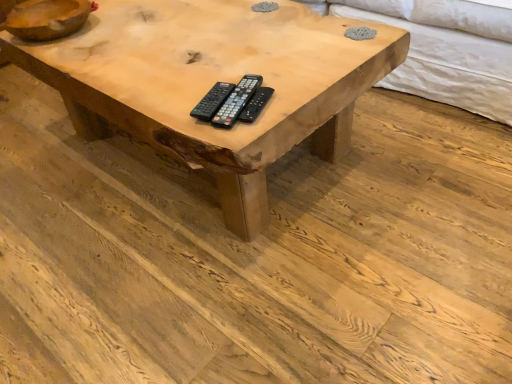
At what (x,y) coordinates should I click in order to perform the action: click on unoccupied area in front of natural wood coffee table at center. Please return your answer as a coordinate pair (x, y). Image resolution: width=512 pixels, height=384 pixels. Looking at the image, I should click on (220, 286).